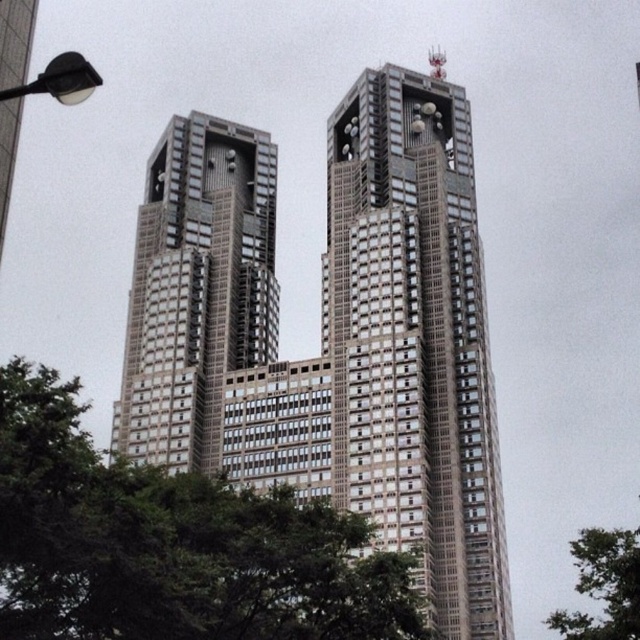
Can you confirm if green leafy tree at center is wider than green leafy tree at lower right?

No, green leafy tree at center is not wider than green leafy tree at lower right.

This screenshot has height=640, width=640. What do you see at coordinates (172, 545) in the screenshot?
I see `green leafy tree at center` at bounding box center [172, 545].

Which is behind, point (192, 618) or point (561, 621)?

Positioned behind is point (561, 621).

I want to click on green leafy tree at center, so click(x=172, y=545).

Is metallic glass skyscraper at center further to camera compared to green leafy tree at center?

Yes, metallic glass skyscraper at center is further from the viewer.

Can you confirm if metallic glass skyscraper at center is positioned to the right of green leafy tree at center?

Indeed, metallic glass skyscraper at center is positioned on the right side of green leafy tree at center.

Who is more forward, (429, 444) or (189, 506)?

Point (189, 506) is more forward.

Where is `metallic glass skyscraper at center`? The height and width of the screenshot is (640, 640). metallic glass skyscraper at center is located at coordinates (413, 340).

From the picture: Does gray metallic building at center lie in front of metallic silver bell tower at center?

Yes.

Identify the location of gray metallic building at center. (332, 333).